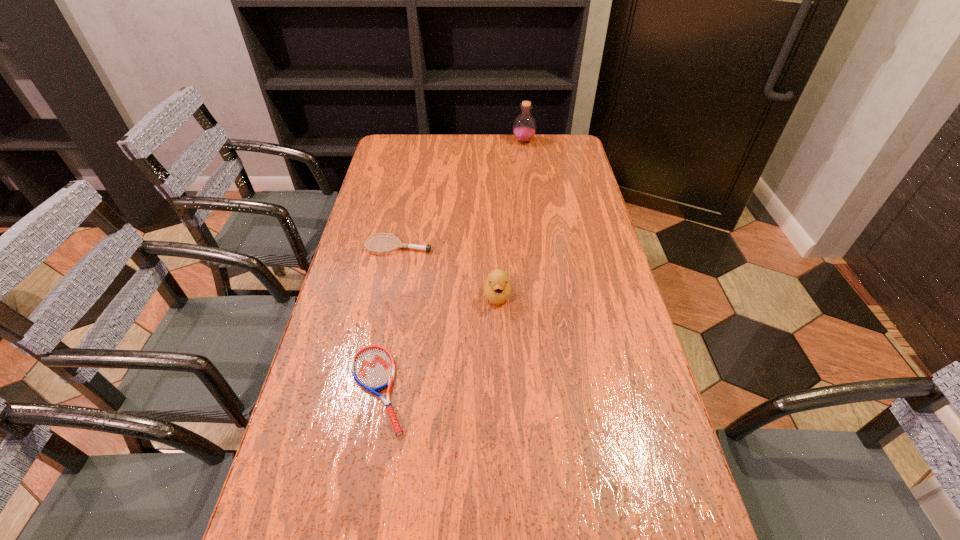
Identify the location of free point between the tallest object and the duckling. The image size is (960, 540). (511, 218).

Locate an element on the screen. The height and width of the screenshot is (540, 960). free space that is in between the taller tennis racket and the tallest object is located at coordinates (461, 194).

This screenshot has width=960, height=540. Find the location of `free space between the farther tennis racket and the farthest object`. free space between the farther tennis racket and the farthest object is located at coordinates (461, 194).

This screenshot has width=960, height=540. In order to click on vacant area between the farthest object and the nearer tennis racket in this screenshot , I will do `click(451, 265)`.

Locate an element on the screen. Image resolution: width=960 pixels, height=540 pixels. free space between the farther tennis racket and the bottle is located at coordinates (461, 194).

The image size is (960, 540). What are the coordinates of `unoccupied area between the farther tennis racket and the second tallest object` in the screenshot? It's located at (448, 271).

You are a GUI agent. You are given a task and a screenshot of the screen. Output one action in this format:
    pyautogui.click(x=<x>, y=<y>)
    Task: Click on the object identified as the third closest to the second tallest object
    The height and width of the screenshot is (540, 960).
    Given the screenshot: What is the action you would take?
    pyautogui.click(x=524, y=127)

I want to click on object identified as the second closest to the second object from right to left, so click(373, 367).

Where is `vacant region that satisfies the following two spatial constraints: 1. on the back side of the nearer tennis racket; 2. on the left side of the farthest object`? vacant region that satisfies the following two spatial constraints: 1. on the back side of the nearer tennis racket; 2. on the left side of the farthest object is located at coordinates (423, 141).